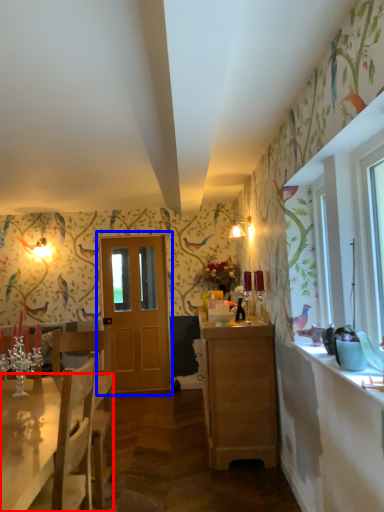
Question: Which of the following is the closest to the observer, desk (highlighted by a red box) or door (highlighted by a blue box)?

Choices:
 (A) desk
 (B) door

Answer: (A)